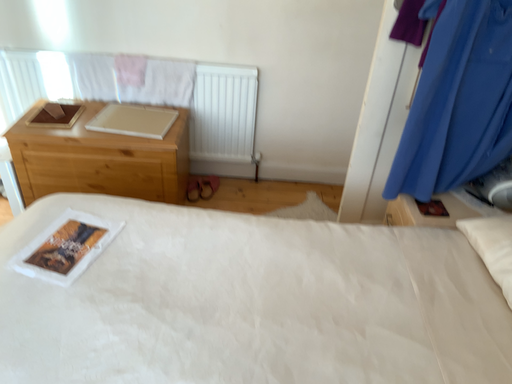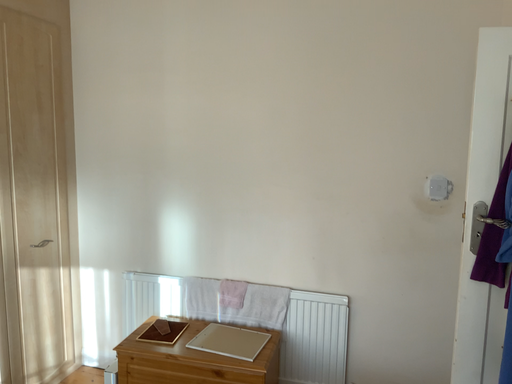
Question: How did the camera likely rotate when shooting the video?

Choices:
 (A) rotated downward
 (B) rotated upward

Answer: (B)